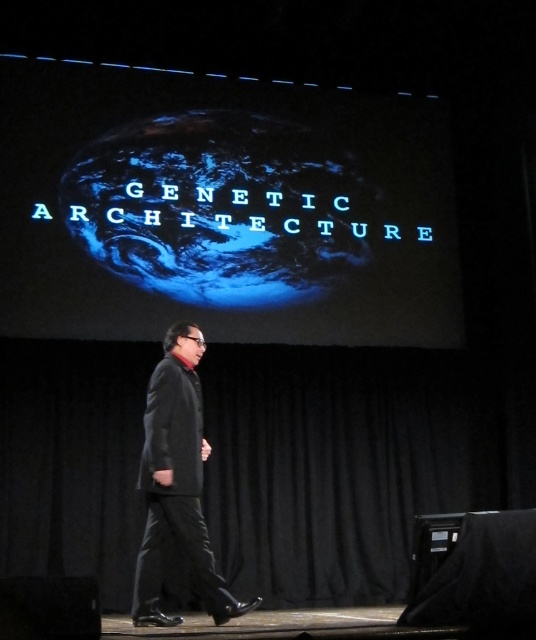
Does blue glossy planet at center have a smaller size compared to dark gray suit at center?

No, blue glossy planet at center is not smaller than dark gray suit at center.

Between blue glossy planet at center and dark gray suit at center, which one appears on the left side from the viewer's perspective?

Positioned to the left is dark gray suit at center.

Where is `blue glossy planet at center`? This screenshot has height=640, width=536. blue glossy planet at center is located at coordinates (221, 209).

Identify the location of blue glossy planet at center. (221, 209).